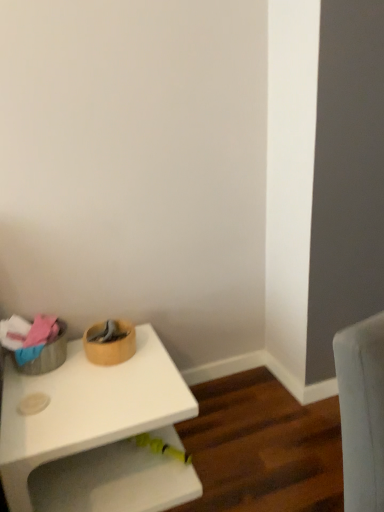
Find the location of a particular element. Image resolution: width=384 pixels, height=512 pixels. vacant area that lies to the right of white matte table at lower left is located at coordinates (244, 439).